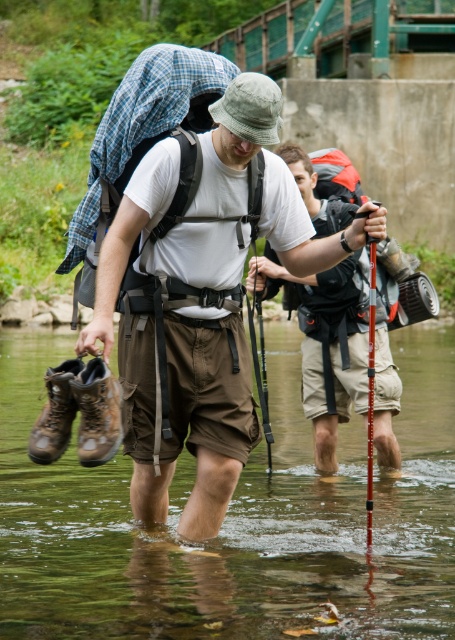
You are a hiker trying to cross the stream safely. You notice the point marked at coordinates (323, 346) in the image. What object at this point should you avoid stepping on to keep your hiking boots dry?

The point marked at coordinates (323, 346) corresponds to the matte khaki shorts at center, which are part of the hiker wearing them. Since the shorts are on the hiker, stepping on that point would mean stepping on the hiker, which is not advisable. To keep your boots dry, avoid stepping on the hiker and navigate around them in the stream.

You are planning to place a red first aid kit on the brown canvas backpack at center. The coordinates for placement are given as point A at (187, 308). Is point A the correct location for placing the first aid kit on the brown canvas backpack at center?

Yes, point A at (187, 308) corresponds to the brown canvas backpack at center, so placing the red first aid kit there would be correct.

You are a hiker planning to place a map on the ground next to your brown canvas backpack at center. If you want the map to be visible from the stream, where should you place it relative to the backpack?

The map should be placed to the left of the brown canvas backpack at center because the backpack is positioned at point (187, 308), which is closer to the stream on the left side of the image.